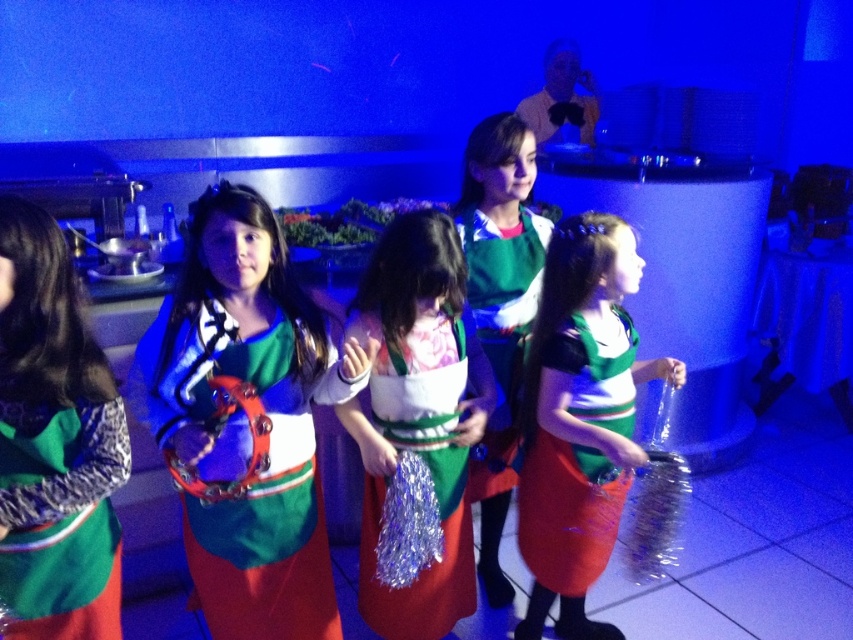
This screenshot has width=853, height=640. What are the coordinates of `green matte dress at center` in the screenshot? It's located at (579, 419).

Which is more to the right, green matte dress at center or shiny green dress at center?

green matte dress at center

Between point (637, 456) and point (492, 339), which one is positioned in front?

Point (637, 456)

At what (x,y) coordinates should I click in order to perform the action: click on green matte dress at center. Please return your answer as a coordinate pair (x, y). Looking at the image, I should click on click(579, 419).

In the scene shown: Is shiny metallic tambourine at center closer to the viewer compared to shiny green dress at center?

Yes, shiny metallic tambourine at center is closer to the viewer.

Where is `shiny metallic tambourine at center`? Image resolution: width=853 pixels, height=640 pixels. shiny metallic tambourine at center is located at coordinates (418, 413).

Is point (404, 339) farther from camera compared to point (495, 205)?

No.

Locate an element on the screen. The height and width of the screenshot is (640, 853). shiny metallic tambourine at center is located at coordinates (418, 413).

Between point (634, 353) and point (18, 461), which one is positioned in front?

Positioned in front is point (18, 461).

Between point (567, 435) and point (109, 516), which one is positioned behind?

Point (567, 435)

Where is `green matte dress at center`? green matte dress at center is located at coordinates (579, 419).

Where is `green matte dress at center`? green matte dress at center is located at coordinates (579, 419).